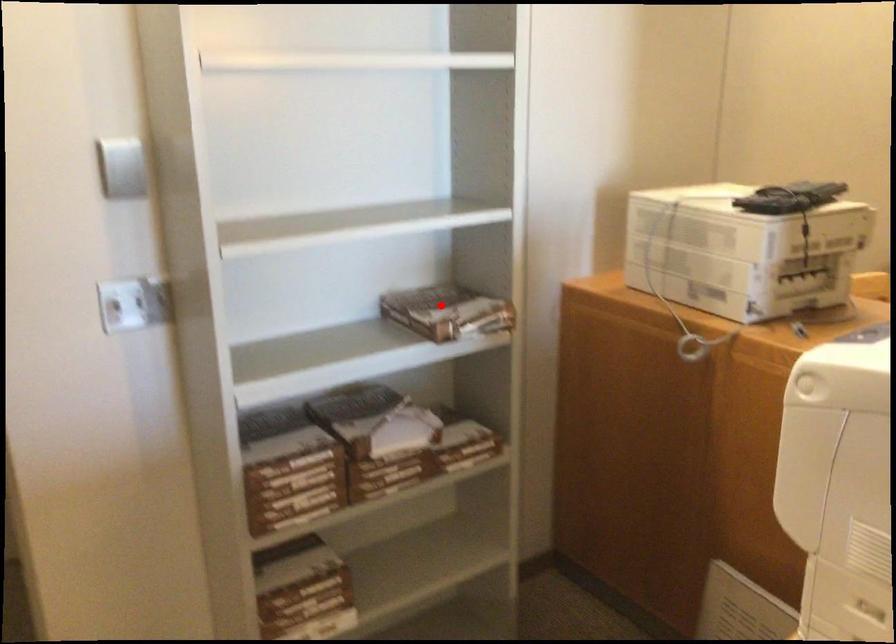
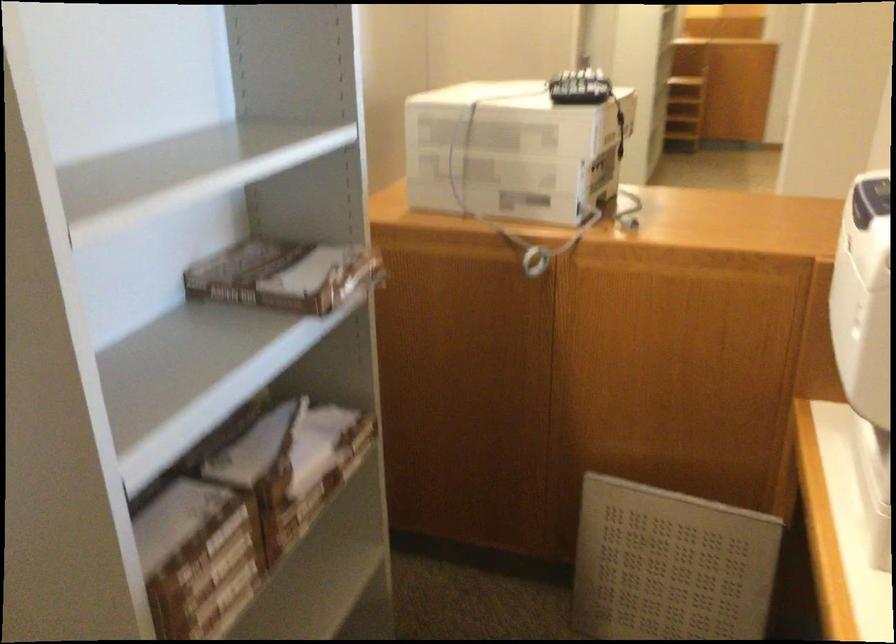
Question: I am providing you with two images of the same scene from different viewpoints. A red point is shown in image1. For the corresponding object point in image2, is it positioned nearer or farther from the camera?

Choices:
 (A) Nearer
 (B) Farther

Answer: (A)